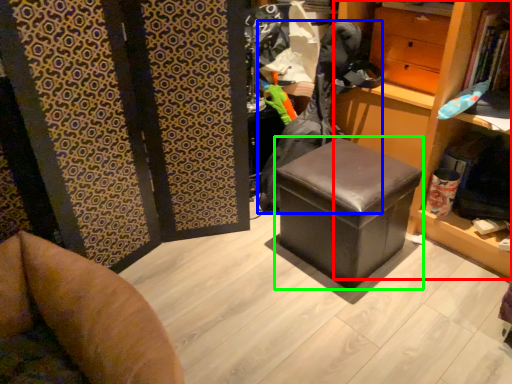
Question: Estimate the real-world distances between objects in this image. Which object is closer to bookshelf (highlighted by a red box), clothing (highlighted by a blue box) or stool (highlighted by a green box)?

Choices:
 (A) clothing
 (B) stool

Answer: (A)